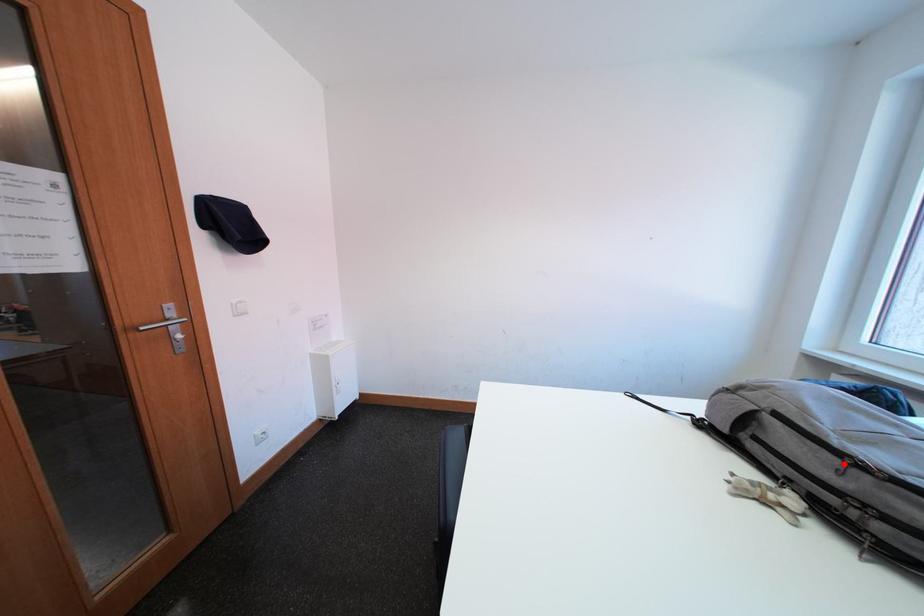
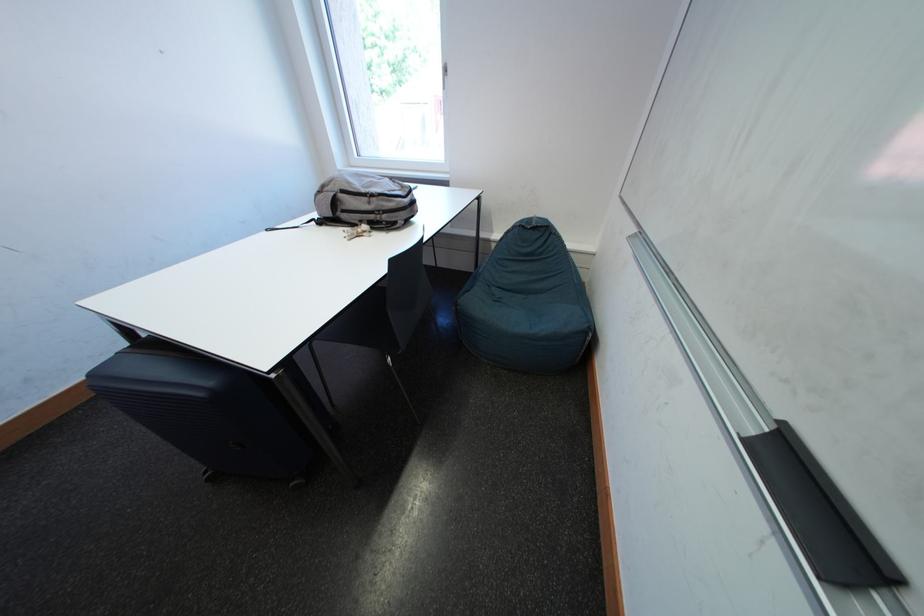
Find the pixel in the second image that matches the highlighted location in the first image.

(375, 203)